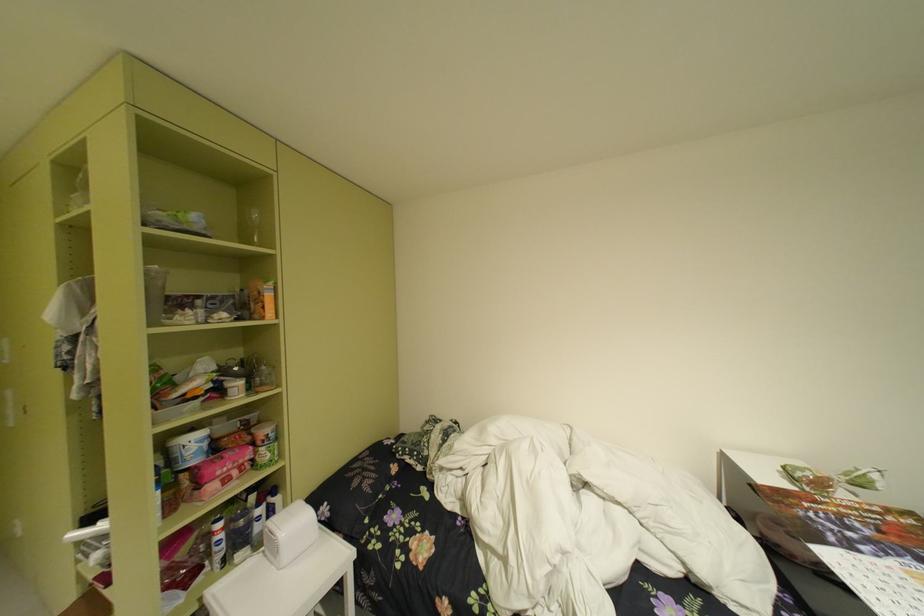
Where would you lift the small white appliance? Please return your answer as a coordinate pair (x, y).

(289, 533)